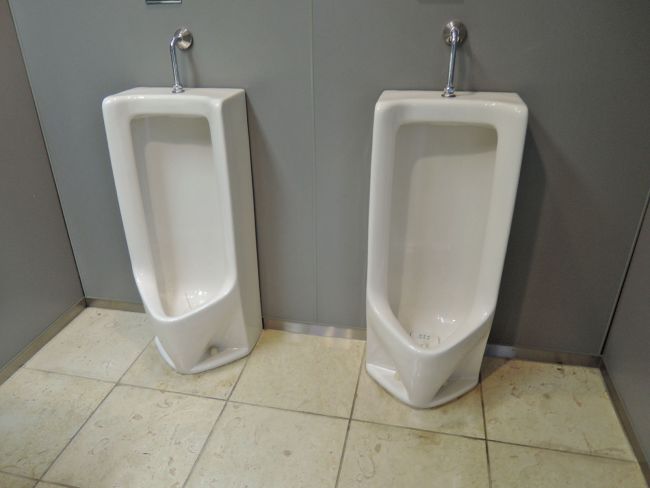
The width and height of the screenshot is (650, 488). What are the coordinates of `wall` in the screenshot? It's located at click(x=624, y=333).